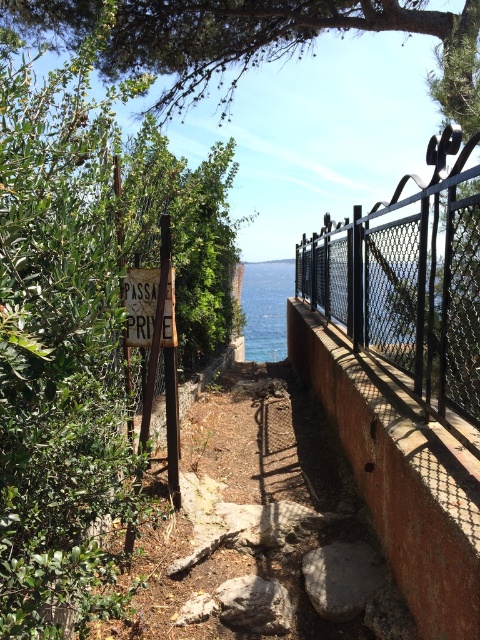
In the scene shown: Does blue water at center appear on the right side of wooden signboard at center?

Correct, you'll find blue water at center to the right of wooden signboard at center.

The width and height of the screenshot is (480, 640). Describe the element at coordinates (265, 308) in the screenshot. I see `blue water at center` at that location.

Find the location of a particular element. blue water at center is located at coordinates (265, 308).

Based on the photo, who is positioned more to the right, brown stone wall at center or blue water at upper center?

Positioned to the right is blue water at upper center.

I want to click on brown stone wall at center, so coord(264,525).

At what (x,y) coordinates should I click in order to perform the action: click on green leafy tree at left. Please return your answer as a coordinate pair (x, y). This screenshot has height=640, width=480. Looking at the image, I should click on (82, 316).

Between green leafy tree at left and brown stone wall at center, which one appears on the left side from the viewer's perspective?

From the viewer's perspective, green leafy tree at left appears more on the left side.

Who is more forward, (15, 486) or (196, 488)?

Positioned in front is point (15, 486).

Identify the location of green leafy tree at left. This screenshot has width=480, height=640. (82, 316).